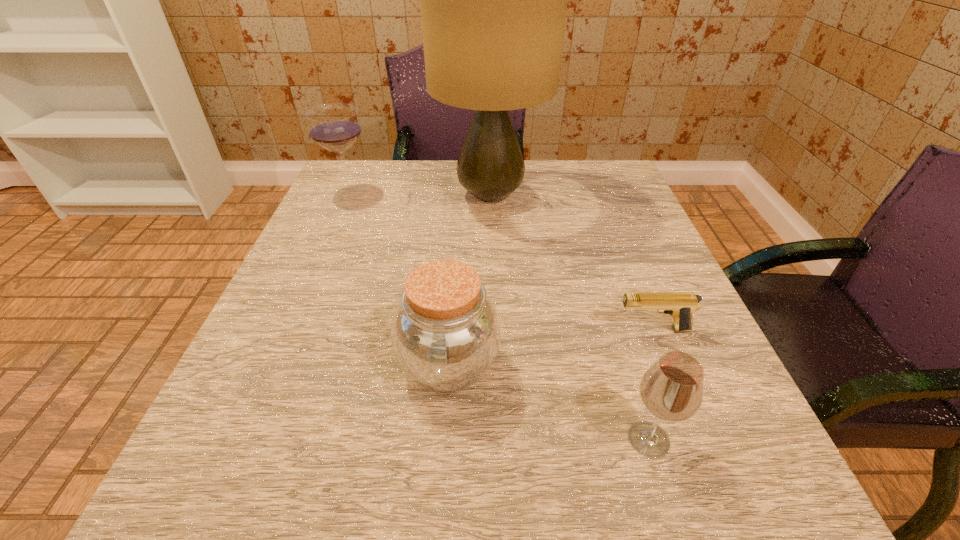
The height and width of the screenshot is (540, 960). I want to click on the tallest object, so click(493, 0).

Where is `the farther wineglass`? The height and width of the screenshot is (540, 960). the farther wineglass is located at coordinates (335, 127).

Find the location of a particular element. the leftmost object is located at coordinates (335, 127).

Locate an element on the screen. The height and width of the screenshot is (540, 960). jar is located at coordinates (445, 333).

You are a GUI agent. You are given a task and a screenshot of the screen. Output one action in this format:
    pyautogui.click(x=<x>, y=<y>)
    Task: Click on the right wineglass
    The image size is (960, 540).
    Given the screenshot: What is the action you would take?
    pyautogui.click(x=672, y=389)

The width and height of the screenshot is (960, 540). In order to click on the nearer wineglass in this screenshot , I will do `click(672, 389)`.

Image resolution: width=960 pixels, height=540 pixels. I want to click on pistol, so click(x=680, y=305).

Locate an element on the screen. free space located on the back of the lampshade is located at coordinates (489, 160).

At what (x,y) coordinates should I click in order to perform the action: click on free space located 0.170m on the right of the left wineglass. Please return your answer as a coordinate pair (x, y). Looking at the image, I should click on (443, 193).

In order to click on vacant space positioned 0.340m on the right of the jar in this screenshot , I will do `click(722, 365)`.